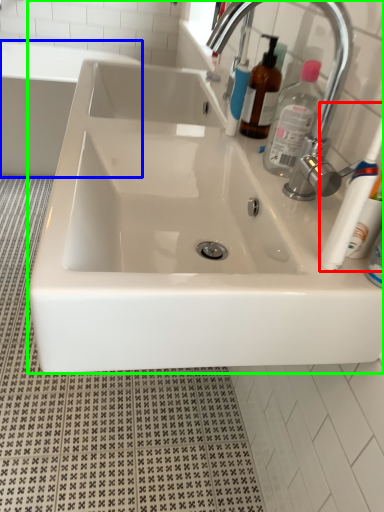
Question: Which object is the closest to the toothbrush (highlighted by a red box)? Choose among these: bath (highlighted by a blue box) or sink (highlighted by a green box).

Choices:
 (A) bath
 (B) sink

Answer: (B)